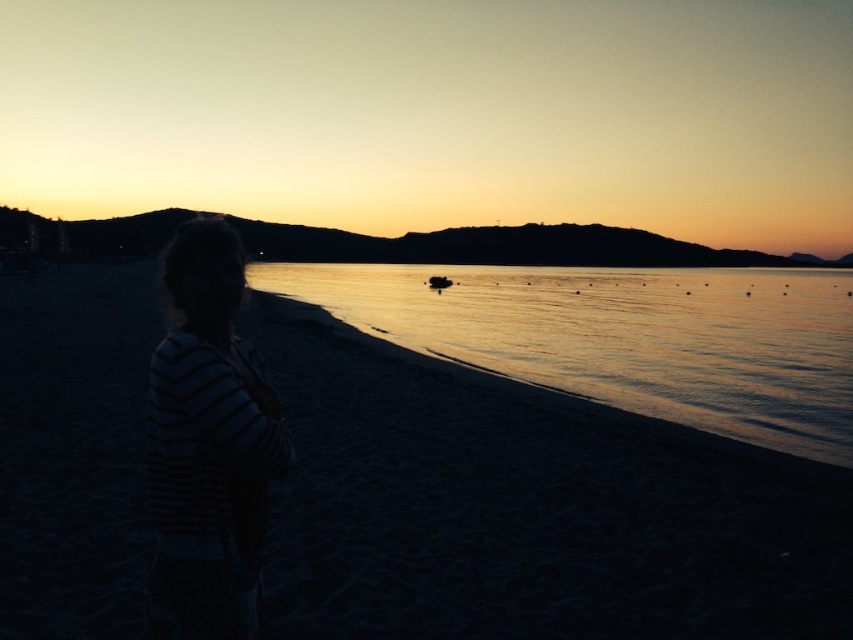
Between glistening water at center and striped fabric at left, which one has less height?

striped fabric at left is shorter.

From the picture: Can you confirm if glistening water at center is thinner than striped fabric at left?

In fact, glistening water at center might be wider than striped fabric at left.

Does point (370, 285) come in front of point (199, 472)?

No, it is not.

Where is `glistening water at center`? The height and width of the screenshot is (640, 853). glistening water at center is located at coordinates (624, 337).

Is dark sand at lower left to the left of glistening water at center from the viewer's perspective?

Indeed, dark sand at lower left is positioned on the left side of glistening water at center.

This screenshot has height=640, width=853. I want to click on dark sand at lower left, so click(527, 515).

Does dark sand at lower left appear on the right side of striped fabric at left?

Incorrect, dark sand at lower left is not on the right side of striped fabric at left.

Who is lower down, dark sand at lower left or striped fabric at left?

dark sand at lower left is below.

Describe the element at coordinates (527, 515) in the screenshot. The width and height of the screenshot is (853, 640). I see `dark sand at lower left` at that location.

Identify the location of dark sand at lower left. (527, 515).